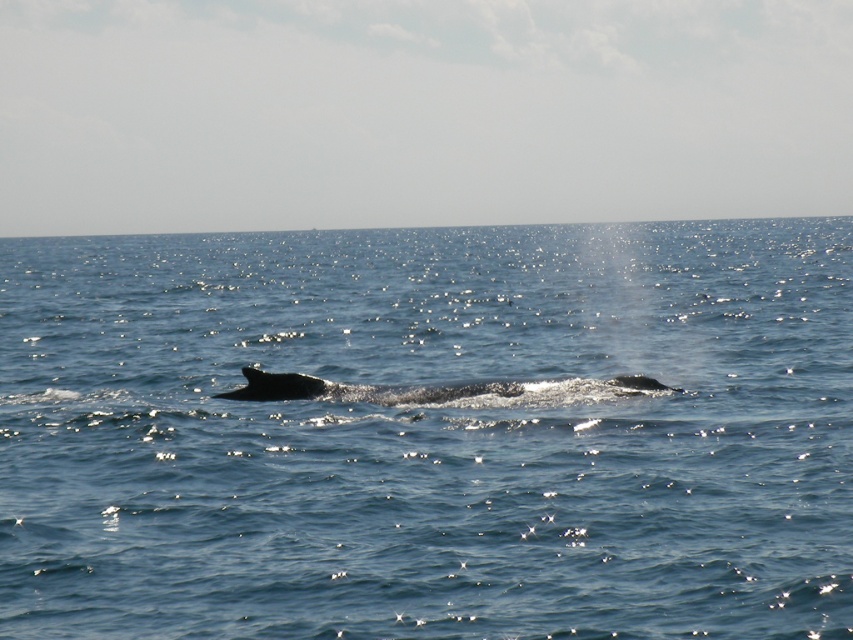
You are a pilot flying a small plane and need to determine the altitude to safely pass over the gray smooth whale at center without disturbing it. Given that the blue water at center is above the whale, what minimum altitude should you maintain?

The blue water at center is above the gray smooth whale at center, so the whale is submerged underwater. Since the water surface is at the same level as the plane, maintaining an altitude above the water surface would ensure safe passage without disturbing the whale.

Consider the image. You are a marine biologist observing the ocean scene. You notice the blue water at center and the gray smooth whale at center. Which object appears taller in the image?

The blue water at center is taller than the gray smooth whale at center according to the description.